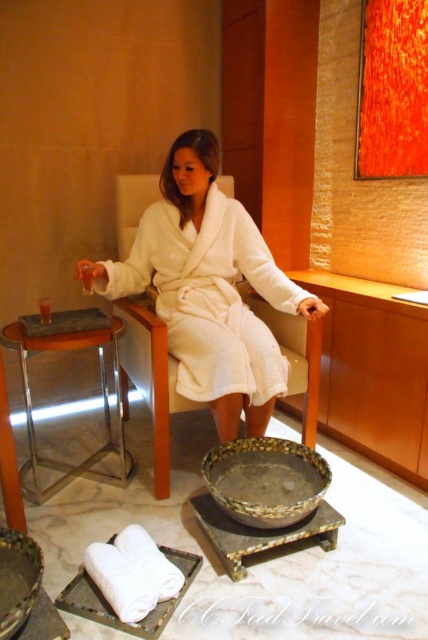
You are a service robot in a spa. You need to place a tray on the floor near the metallic silver stool at left. The coordinates for the floor area where you can place the tray are between x from 0.6 to 0.66 and y from 0.2 to 0.28. Can you place the tray there?

Yes, the metallic silver stool at left is at coordinates point (103,404), so placing the tray between x 0.6 to 0.66 and y 0.2 to 0.28 would be near it.

You are a spa attendant who needs to place a new decorative bowl on the left side of the room. There is a metallic silver stool at left and a matte black tray at left. Which object should you choose to place the bowl on so that it fits properly?

The metallic silver stool at left is wider than the matte black tray at left, so placing the bowl on the metallic silver stool at left would ensure it fits properly.

You are a spa attendant who needs to place a 10 inch long decorative bowl on the left side of the room. The bowl must be placed between the metallic silver stool at left and the matte black tray at left. Is there enough space between them to fit the bowl?

The metallic silver stool at left and matte black tray at left are 8.46 inches apart. Since the decorative bowl is 10 inches long, it cannot fit between them as the space is smaller than the bowl.